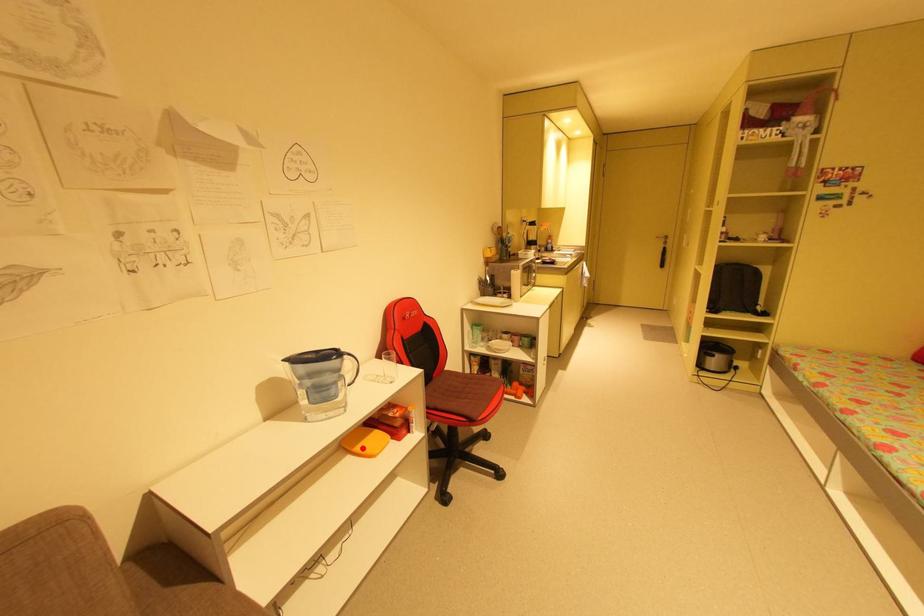
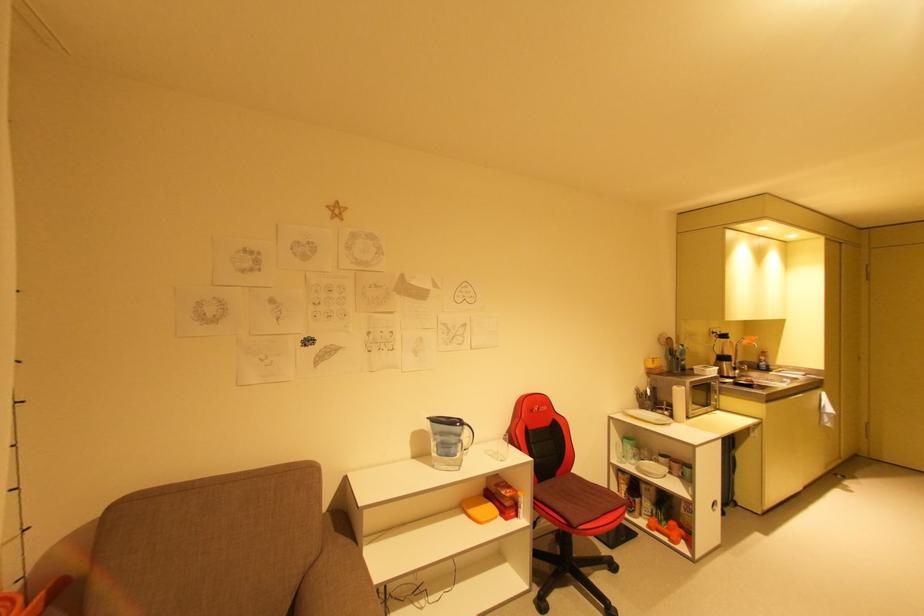
Locate, in the second image, the point that corresponds to the highlighted location in the first image.

(477, 512)